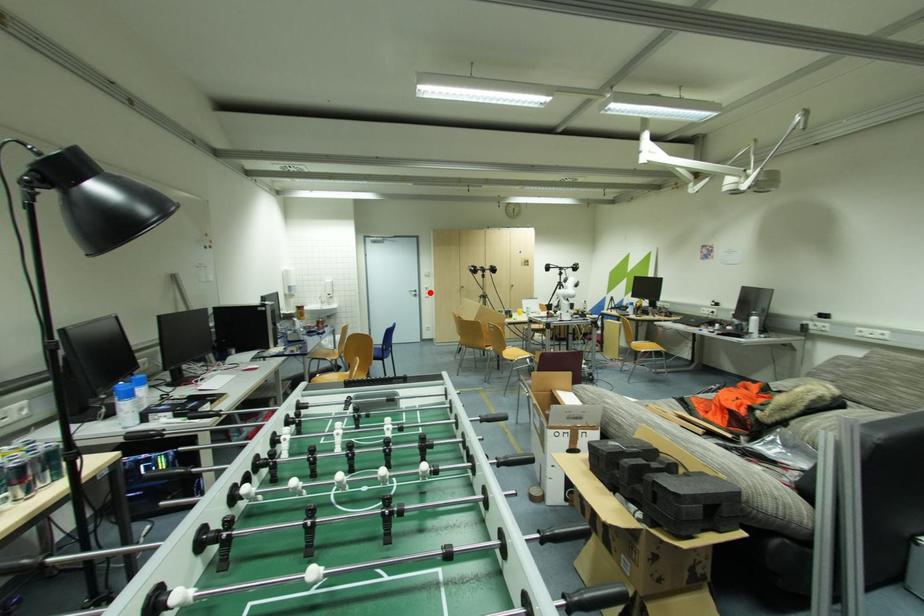
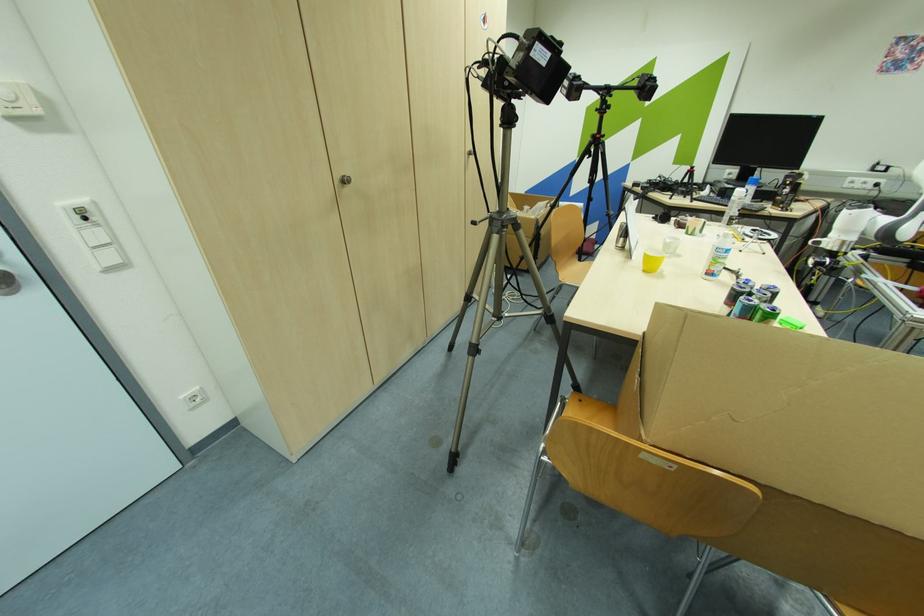
Locate, in the second image, the point that corresponds to the highlighted location in the first image.

(102, 236)